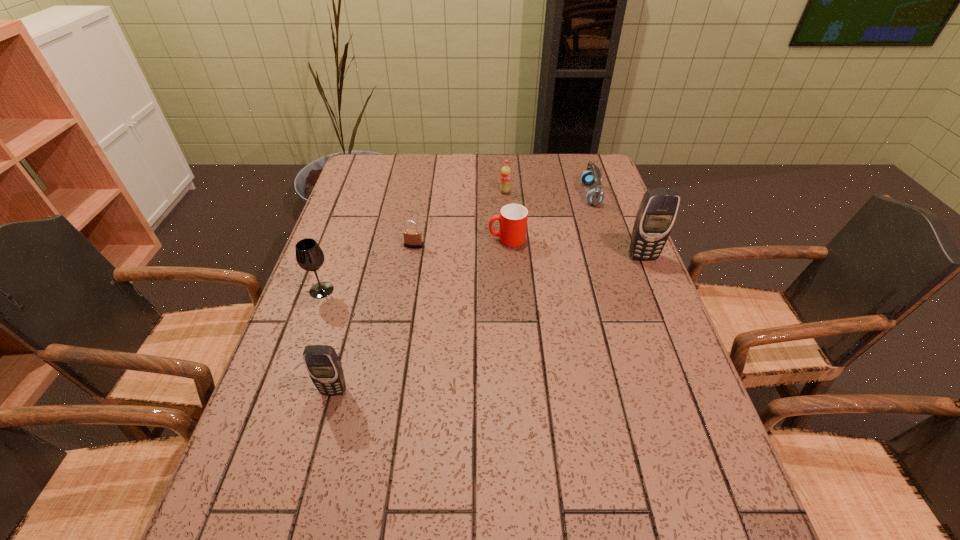
The width and height of the screenshot is (960, 540). I want to click on vacant region located on the front face of the nearer cellular telephone, so click(307, 490).

Where is `vacant space located 0.060m on the front face of the taller cellular telephone`? The height and width of the screenshot is (540, 960). vacant space located 0.060m on the front face of the taller cellular telephone is located at coordinates (651, 277).

The height and width of the screenshot is (540, 960). Find the location of `vacant space located on the front of the soda`. vacant space located on the front of the soda is located at coordinates (506, 208).

What are the coordinates of `free location located on the ear cups of the second object from right to left` in the screenshot? It's located at (478, 194).

Where is `free space located 0.270m on the ear cups of the second object from right to left`? This screenshot has height=540, width=960. free space located 0.270m on the ear cups of the second object from right to left is located at coordinates (502, 194).

Where is `vacant point located on the ear cups of the second object from right to left`? vacant point located on the ear cups of the second object from right to left is located at coordinates (488, 194).

The image size is (960, 540). I want to click on vacant region located on the side of the cup with the handle, so click(x=381, y=239).

Locate an element on the screen. vacant position located 0.130m on the side of the cup with the handle is located at coordinates (445, 239).

What are the coordinates of `vacant space situated 0.080m on the side of the cup with the handle` in the screenshot? It's located at (462, 239).

Identify the location of vacant space located on the right of the leftmost object. The width and height of the screenshot is (960, 540). (474, 290).